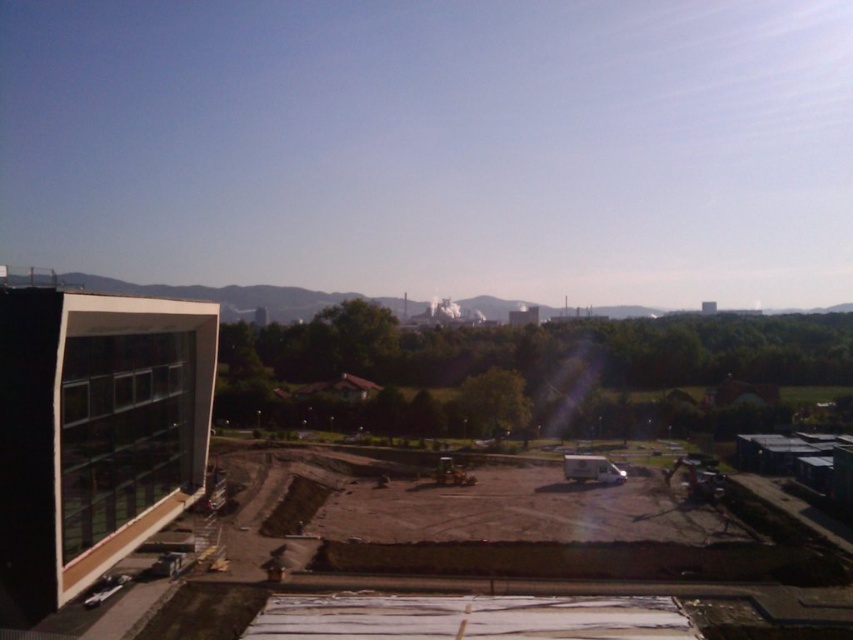
Question: Is brown dirt at center smaller than matte glass building at left?

Choices:
 (A) yes
 (B) no

Answer: (B)

Question: Is brown dirt at center positioned before matte glass building at left?

Choices:
 (A) no
 (B) yes

Answer: (A)

Question: Among these objects, which one is nearest to the camera?

Choices:
 (A) matte glass building at left
 (B) brown dirt at center

Answer: (A)

Question: Does brown dirt at center appear on the right side of matte glass building at left?

Choices:
 (A) yes
 (B) no

Answer: (A)

Question: Which point appears farthest from the camera in this image?

Choices:
 (A) (109, 548)
 (B) (170, 513)

Answer: (B)

Question: Among these points, which one is nearest to the camera?

Choices:
 (A) (24, 472)
 (B) (4, 456)

Answer: (A)